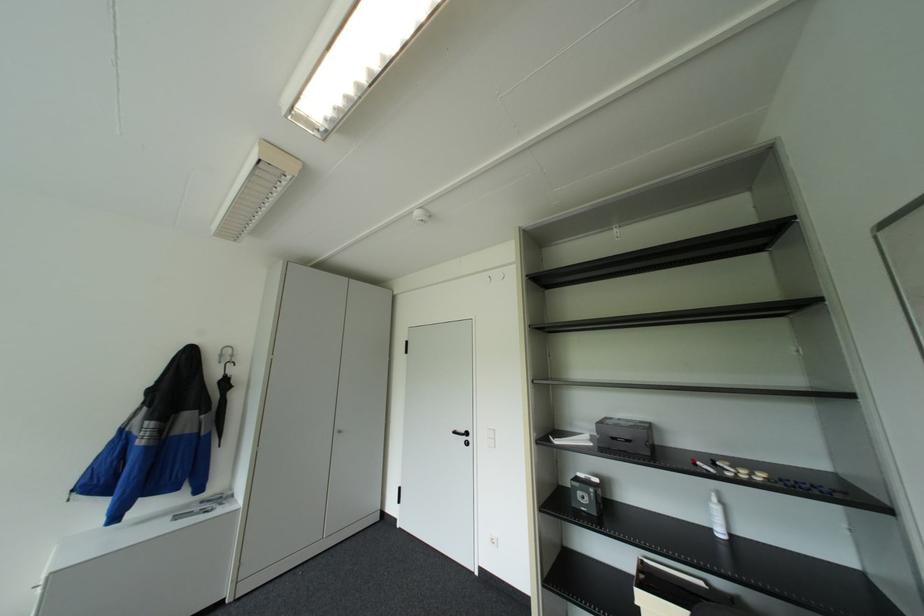
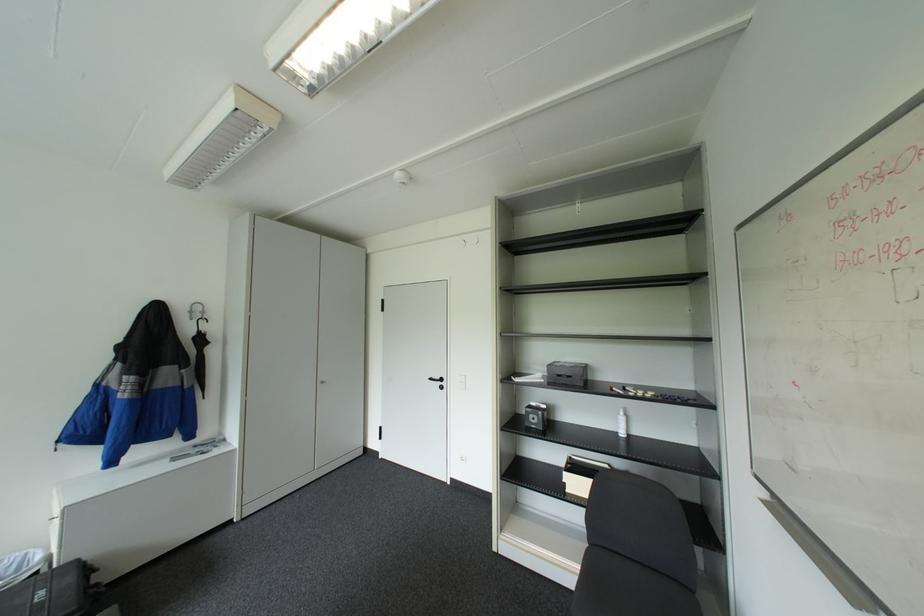
Where in the second image is the point corresponding to (227,361) from the first image?

(200, 318)